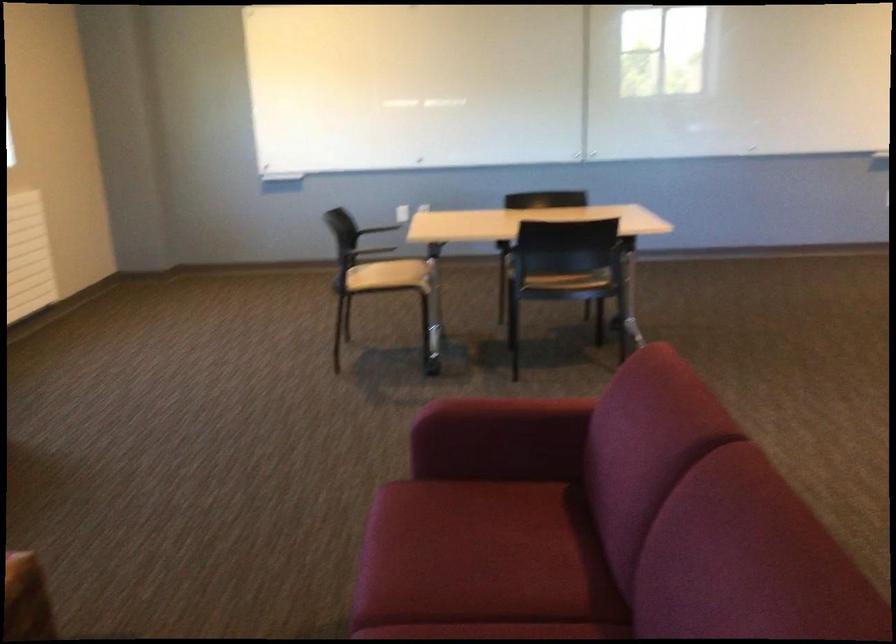
Find the location of `red sofa armrest`. red sofa armrest is located at coordinates (502, 422).